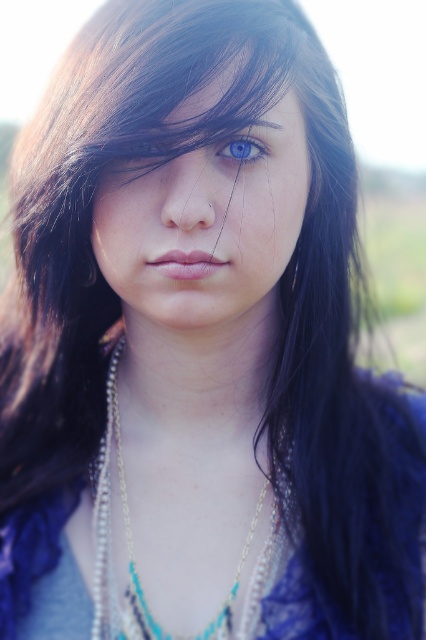
You are a fashion designer analyzing the portrait. The point at coordinates (31, 547) is part of an object in the image. Which object is it part of?

The point at coordinates (31, 547) is part of the blue fabric dress at center.